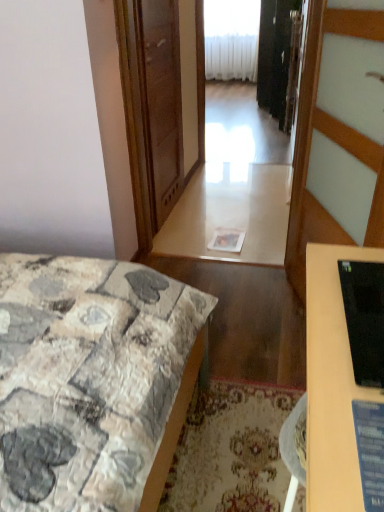
This screenshot has width=384, height=512. What do you see at coordinates (231, 57) in the screenshot?
I see `white plastic radiator at upper center` at bounding box center [231, 57].

Describe the element at coordinates (370, 451) in the screenshot. The image size is (384, 512). I see `black glossy monitor at lower right` at that location.

You are a GUI agent. You are given a task and a screenshot of the screen. Output one action in this format:
    pyautogui.click(x=<x>, y=<y>)
    Task: Click on the white glossy table at center
    The width and height of the screenshot is (384, 512).
    Given the screenshot: What is the action you would take?
    pyautogui.click(x=230, y=213)

The image size is (384, 512). I want to click on carpeted mat at lower center, so click(x=231, y=450).

At what (x,y) coordinates should I click in order to perform the action: click on white plastic radiator at upper center. Please return your answer as a coordinate pair (x, y). The width and height of the screenshot is (384, 512). Looking at the image, I should click on (231, 57).

From a real-world perspective, is white wood door at center located higher than black glossy monitor at right?

No.

This screenshot has height=512, width=384. I want to click on computer monitor below the white wood door at center (from the image's perspective), so click(364, 319).

Looking at this image, is white wood door at center facing away from black glossy monitor at right?

No, white wood door at center is not facing the opposite direction of black glossy monitor at right.

Which of these two, white wood door at center or black glossy monitor at right, is wider?

white wood door at center is wider.

Is black glossy monitor at lower right bigger or smaller than white wood door at center?

In the image, black glossy monitor at lower right appears to be smaller than white wood door at center.

Is point (353, 404) closer or farther from the camera than point (299, 268)?

Clearly, point (353, 404) is closer to the camera than point (299, 268).

Considering the relative positions of black glossy monitor at lower right and white wood door at center in the image provided, is black glossy monitor at lower right to the left or to the right of white wood door at center?

From the image, it's evident that black glossy monitor at lower right is to the left of white wood door at center.

Does white wood door at center turn towards carpeted mat at lower center?

No, white wood door at center is not facing towards carpeted mat at lower center.

Are white wood door at center and carpeted mat at lower center beside each other?

white wood door at center and carpeted mat at lower center are not in contact.

Find the location of a particular element. The image size is (384, 512). door above the carpeted mat at lower center (from a real-world perspective) is located at coordinates (339, 134).

From a real-world perspective, is white wood door at center physically located above or below carpeted mat at lower center?

white wood door at center is above carpeted mat at lower center.

Can you confirm if white wood door at center is smaller than patchwork fabric bed at lower left?

No, white wood door at center is not smaller than patchwork fabric bed at lower left.

Considering the relative positions of white wood door at center and patchwork fabric bed at lower left in the image provided, is white wood door at center in front of patchwork fabric bed at lower left?

Yes, white wood door at center is closer to the viewer.

Are white wood door at center and patchwork fabric bed at lower left located far from each other?

No, white wood door at center is not far from patchwork fabric bed at lower left.

Is white wood door at center spatially inside patchwork fabric bed at lower left, or outside of it?

white wood door at center is spatially situated outside patchwork fabric bed at lower left.

From a real-world perspective, is white glossy table at center on top of white wood door at center?

Actually, white glossy table at center is physically below white wood door at center in the real world.

From the image's perspective, would you say white glossy table at center is shown under white wood door at center?

No, from the image's perspective, white glossy table at center is not beneath white wood door at center.

Considering their positions, is white glossy table at center located in front of or behind white wood door at center?

white glossy table at center is behind white wood door at center.

From the picture: Is black glossy monitor at lower right looking in the opposite direction of patchwork fabric bed at lower left?

No, black glossy monitor at lower right is not facing away from patchwork fabric bed at lower left.

Would you say black glossy monitor at lower right is inside or outside patchwork fabric bed at lower left?

black glossy monitor at lower right lies outside patchwork fabric bed at lower left.

Can you tell me how much black glossy monitor at lower right and patchwork fabric bed at lower left differ in facing direction?

They differ by 90 degrees in their facing directions.

Which of these two, black glossy monitor at lower right or patchwork fabric bed at lower left, stands shorter?

Standing shorter between the two is black glossy monitor at lower right.

From a real-world perspective, is black glossy monitor at right positioned over black glossy monitor at lower right based on gravity?

Yes, from a real-world perspective, black glossy monitor at right is on top of black glossy monitor at lower right.

This screenshot has width=384, height=512. In order to click on computer monitor above the black glossy monitor at lower right (from a real-world perspective) in this screenshot , I will do pyautogui.click(x=364, y=319).

Who is bigger, black glossy monitor at right or black glossy monitor at lower right?

black glossy monitor at right.

Looking at this image, between black glossy monitor at right and black glossy monitor at lower right, which one has larger width?

black glossy monitor at lower right is wider.

Identify the location of door beneath the black glossy monitor at right (from a real-world perspective). (339, 134).

Where is `door on the right side of black glossy monitor at lower right`? The width and height of the screenshot is (384, 512). door on the right side of black glossy monitor at lower right is located at coordinates [x=339, y=134].

Which object lies nearer to the anchor point white wood door at center, patchwork fabric bed at lower left or carpeted mat at lower center?

carpeted mat at lower center.

Which object lies further to the anchor point black glossy monitor at lower right, white plastic radiator at upper center or transparent glass screen door at center?

Based on the image, white plastic radiator at upper center appears to be further to black glossy monitor at lower right.

Looking at the image, which one is located closer to carpeted mat at lower center, patchwork fabric bed at lower left or black glossy monitor at lower right?

The object closer to carpeted mat at lower center is patchwork fabric bed at lower left.

Considering their positions, is transparent glass screen door at center positioned further to black glossy monitor at lower right than carpeted mat at lower center?

transparent glass screen door at center is further to black glossy monitor at lower right.

Looking at the image, which one is located further to white glossy table at center, white wood door at center or black glossy monitor at lower right?

Based on the image, black glossy monitor at lower right appears to be further to white glossy table at center.

Which object lies nearer to the anchor point black glossy monitor at lower right, carpeted mat at lower center or patchwork fabric bed at lower left?

The object closer to black glossy monitor at lower right is patchwork fabric bed at lower left.

Which object lies further to the anchor point transparent glass screen door at center, white wood door at center or black glossy monitor at right?

black glossy monitor at right is positioned further to the anchor transparent glass screen door at center.

Based on the photo, considering their positions, is black glossy monitor at right positioned further to patchwork fabric bed at lower left than white wood door at center?

Based on the image, white wood door at center appears to be further to patchwork fabric bed at lower left.

Where is `computer monitor positioned between black glossy monitor at lower right and patchwork fabric bed at lower left from near to far`? The image size is (384, 512). computer monitor positioned between black glossy monitor at lower right and patchwork fabric bed at lower left from near to far is located at coordinates (364, 319).

Identify the location of screen door positioned between patchwork fabric bed at lower left and white plastic radiator at upper center from near to far. (160, 102).

This screenshot has width=384, height=512. Find the location of `table positioned between patchwork fabric bed at lower left and white plastic radiator at upper center from near to far`. table positioned between patchwork fabric bed at lower left and white plastic radiator at upper center from near to far is located at coordinates (230, 213).

I want to click on computer monitor located between black glossy monitor at lower right and transparent glass screen door at center in the depth direction, so click(x=364, y=319).